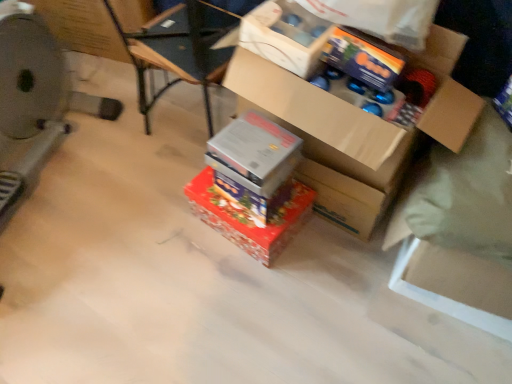
This screenshot has width=512, height=384. I want to click on empty space that is to the right of metallic silver exercise machine at left, so click(151, 220).